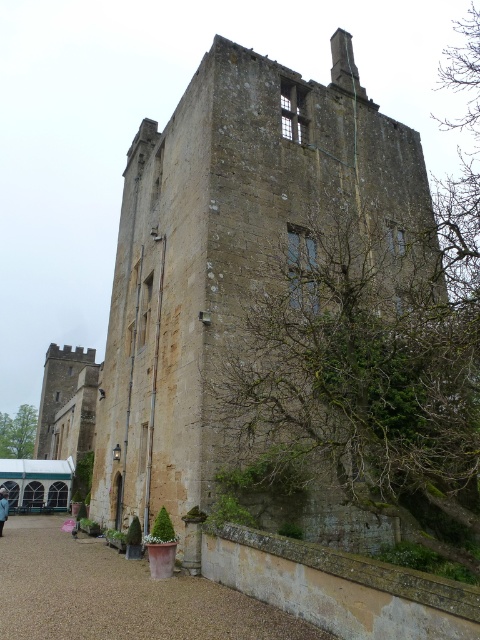
Question: Which object is closer to the camera taking this photo?

Choices:
 (A) brown gravel driveway at lower center
 (B) brown stone castle at center

Answer: (A)

Question: Among these objects, which one is nearest to the camera?

Choices:
 (A) brown gravel driveway at lower center
 (B) brown stone castle at center

Answer: (A)

Question: Considering the relative positions of brown stone castle at center and brown gravel driveway at lower center in the image provided, where is brown stone castle at center located with respect to brown gravel driveway at lower center?

Choices:
 (A) below
 (B) above

Answer: (B)

Question: Can you confirm if brown stone castle at center is positioned to the left of brown gravel driveway at lower center?

Choices:
 (A) yes
 (B) no

Answer: (A)

Question: Is brown stone castle at center closer to camera compared to brown gravel driveway at lower center?

Choices:
 (A) no
 (B) yes

Answer: (A)

Question: Among these points, which one is farthest from the camera?

Choices:
 (A) (233, 600)
 (B) (236, 131)

Answer: (B)